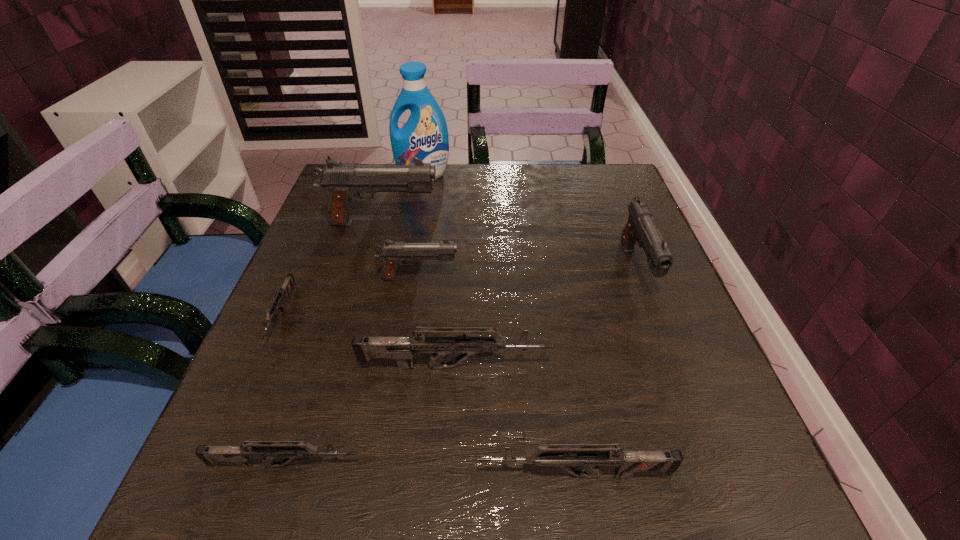
You are a GUI agent. You are given a task and a screenshot of the screen. Output one action in this format:
    pyautogui.click(x=<x>, y=<y>)
    Task: Click on the free region at the far edge
    
    Given the screenshot: What is the action you would take?
    coord(517,213)

Find the location of `vacant space at the near edge`. vacant space at the near edge is located at coordinates (605, 478).

What are the coordinates of `vacant region at the left edge of the desktop` in the screenshot? It's located at [x=324, y=279].

Image resolution: width=960 pixels, height=540 pixels. In the image, there is a desktop. Find the location of `vacant area at the right edge`. vacant area at the right edge is located at coordinates (630, 294).

You are a GUI agent. You are given a task and a screenshot of the screen. Output one action in this format:
    pyautogui.click(x=<x>, y=<y>)
    Task: Click on the vacant space at the far left corner of the desktop
    Image resolution: width=960 pixels, height=540 pixels.
    Given the screenshot: What is the action you would take?
    pyautogui.click(x=385, y=205)

Where is `free region at the near left corner of the desktop`? free region at the near left corner of the desktop is located at coordinates (201, 504).

Image resolution: width=960 pixels, height=540 pixels. Identify the location of unoccupied position between the shortest object and the tallest object. (352, 245).

Where is `vacant region between the rightmost gray gun and the tallest gun`? This screenshot has height=540, width=960. vacant region between the rightmost gray gun and the tallest gun is located at coordinates [x=510, y=246].

Image resolution: width=960 pixels, height=540 pixels. I want to click on vacant space that's between the rightmost object and the farthest gray gun, so click(510, 246).

Locate an element on the screen. free spot between the second shortest object and the smallest gray gun is located at coordinates (352, 372).